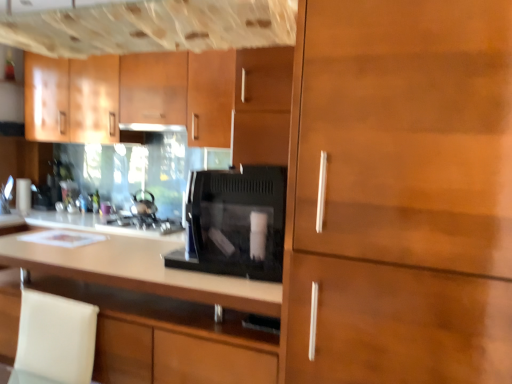
Question: Which direction should I rotate to face matte wood cabinet at center, the 2th cabinetry positioned from the front, — up or down?

Choices:
 (A) up
 (B) down

Answer: (B)

Question: Is shiny metallic kettle at center shorter than wooden cabinet at right, the 1th cabinetry when ordered from front to back?

Choices:
 (A) no
 (B) yes

Answer: (B)

Question: Does shiny metallic kettle at center turn towards wooden cabinet at right, the 1th cabinetry when ordered from front to back?

Choices:
 (A) yes
 (B) no

Answer: (B)

Question: Would you say wooden cabinet at right, the 1th cabinetry when ordered from front to back, is part of shiny metallic kettle at center's contents?

Choices:
 (A) no
 (B) yes

Answer: (A)

Question: From the image's perspective, would you say shiny metallic kettle at center is positioned over wooden cabinet at right, the 1th cabinetry when ordered from front to back?

Choices:
 (A) no
 (B) yes

Answer: (A)

Question: Is shiny metallic kettle at center to the left of wooden cabinet at right, the 1th cabinetry when ordered from front to back, from the viewer's perspective?

Choices:
 (A) no
 (B) yes

Answer: (B)

Question: Does shiny metallic kettle at center have a lesser width compared to wooden cabinet at right, placed as the 3th cabinetry when sorted from back to front?

Choices:
 (A) yes
 (B) no

Answer: (A)

Question: Is black matte microwave at center turned away from matte wood cabinets at upper left, which appears as the first cabinetry when viewed from the back?

Choices:
 (A) yes
 (B) no

Answer: (B)

Question: From the image's perspective, does black matte microwave at center appear higher than matte wood cabinets at upper left, which appears as the first cabinetry when viewed from the back?

Choices:
 (A) yes
 (B) no

Answer: (B)

Question: Is black matte microwave at center wider than matte wood cabinets at upper left, which appears as the first cabinetry when viewed from the back?

Choices:
 (A) yes
 (B) no

Answer: (A)

Question: Does black matte microwave at center have a lesser width compared to matte wood cabinets at upper left, which appears as the first cabinetry when viewed from the back?

Choices:
 (A) no
 (B) yes

Answer: (A)

Question: Considering the relative positions of black matte microwave at center and matte wood cabinets at upper left, which appears as the first cabinetry when viewed from the back, in the image provided, is black matte microwave at center in front of matte wood cabinets at upper left, which appears as the first cabinetry when viewed from the back,?

Choices:
 (A) yes
 (B) no

Answer: (B)

Question: Is black matte microwave at center shorter than matte wood cabinets at upper left, which is the third cabinetry in front-to-back order?

Choices:
 (A) yes
 (B) no

Answer: (A)

Question: Is shiny metallic kettle at center directly adjacent to matte wood cabinets at upper left, which is the third cabinetry in front-to-back order?

Choices:
 (A) yes
 (B) no

Answer: (B)